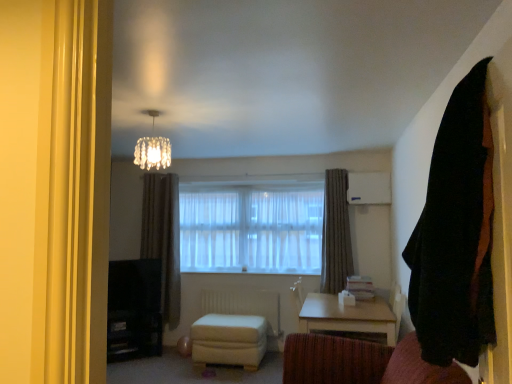
Question: Is light wood/texture table at lower center at the right side of gray textured curtain at center, the second curtain in the front-to-back sequence?

Choices:
 (A) yes
 (B) no

Answer: (B)

Question: Does light wood/texture table at lower center appear on the left side of gray textured curtain at center, placed as the 3th curtain when sorted from left to right?

Choices:
 (A) no
 (B) yes

Answer: (B)

Question: Is the depth of light wood/texture table at lower center greater than that of gray textured curtain at center, which is the 1th curtain in right-to-left order?

Choices:
 (A) yes
 (B) no

Answer: (B)

Question: Is the position of light wood/texture table at lower center less distant than that of gray textured curtain at center, placed as the 3th curtain when sorted from left to right?

Choices:
 (A) yes
 (B) no

Answer: (A)

Question: Can you confirm if light wood/texture table at lower center is taller than gray textured curtain at center, the second curtain in the front-to-back sequence?

Choices:
 (A) yes
 (B) no

Answer: (B)

Question: Is light wood/texture table at lower center smaller than gray textured curtain at center, which is the 1th curtain in right-to-left order?

Choices:
 (A) no
 (B) yes

Answer: (A)

Question: From a real-world perspective, is light wood/texture table at lower center beneath white leather stool at center?

Choices:
 (A) yes
 (B) no

Answer: (B)

Question: Considering the relative positions of light wood/texture table at lower center and white leather stool at center in the image provided, is light wood/texture table at lower center to the right of white leather stool at center from the viewer's perspective?

Choices:
 (A) no
 (B) yes

Answer: (B)

Question: Is light wood/texture table at lower center positioned with its back to white leather stool at center?

Choices:
 (A) yes
 (B) no

Answer: (B)

Question: Would you say white leather stool at center is part of light wood/texture table at lower center's contents?

Choices:
 (A) no
 (B) yes

Answer: (A)

Question: Does light wood/texture table at lower center have a lesser height compared to white leather stool at center?

Choices:
 (A) no
 (B) yes

Answer: (A)

Question: Considering the relative sizes of light wood/texture table at lower center and white leather stool at center in the image provided, is light wood/texture table at lower center bigger than white leather stool at center?

Choices:
 (A) yes
 (B) no

Answer: (A)

Question: Is the position of white plastic radiator at lower center less distant than that of white sheer curtains at center?

Choices:
 (A) no
 (B) yes

Answer: (B)